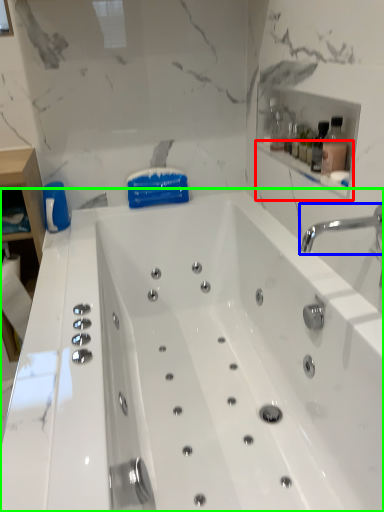
Question: Which object is positioned farthest from balustrade (highlighted by a red box)? Select from tap (highlighted by a blue box) and bathtub (highlighted by a green box).

Choices:
 (A) tap
 (B) bathtub

Answer: (B)